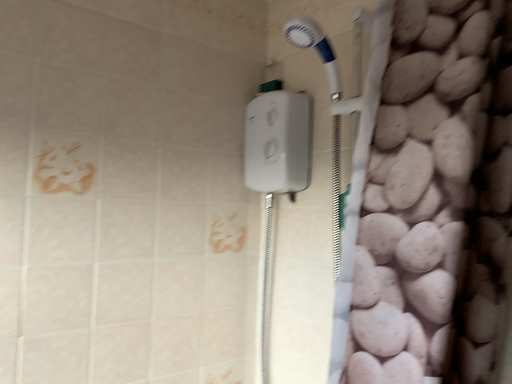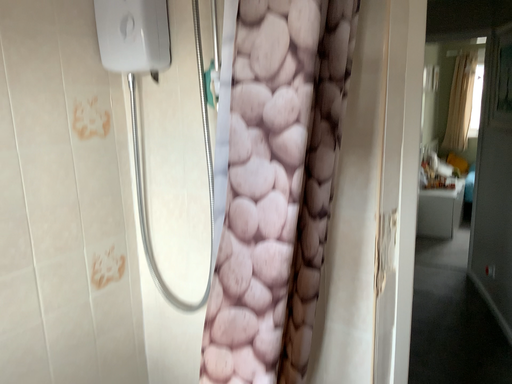
Question: How did the camera likely rotate when shooting the video?

Choices:
 (A) rotated left
 (B) rotated right

Answer: (B)